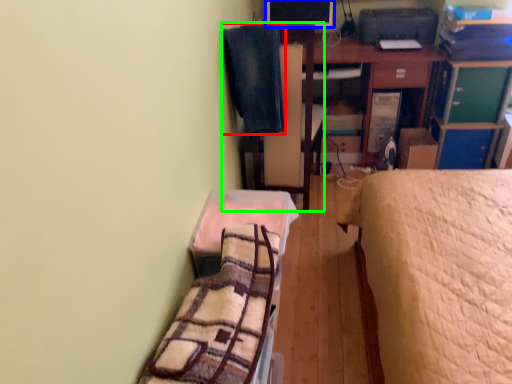
Question: Considering the real-world distances, which object is farthest from blanket (highlighted by a red box)? computer monitor (highlighted by a blue box) or swivel chair (highlighted by a green box)?

Choices:
 (A) computer monitor
 (B) swivel chair

Answer: (A)